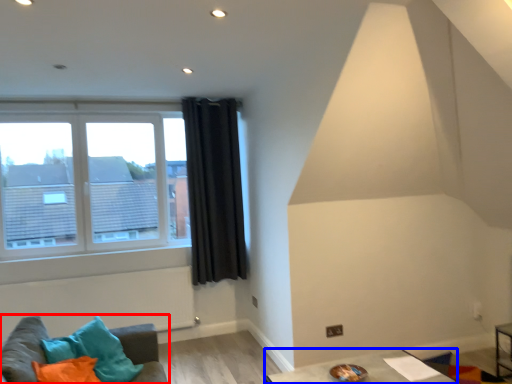
Question: Among these objects, which one is farthest to the camera, studio couch (highlighted by a red box) or table (highlighted by a blue box)?

Choices:
 (A) studio couch
 (B) table

Answer: (B)